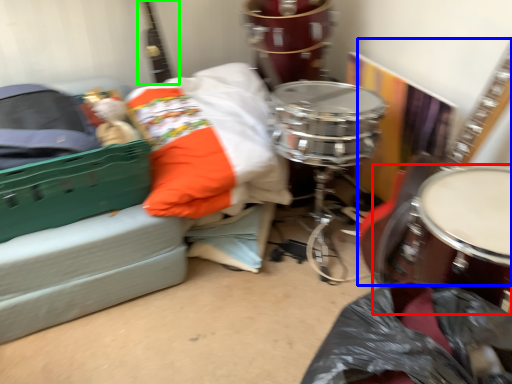
Question: Which object is the closest to the drum (highlighted by a red box)? Choose among these: guitar (highlighted by a blue box) or guitar (highlighted by a green box).

Choices:
 (A) guitar
 (B) guitar

Answer: (A)